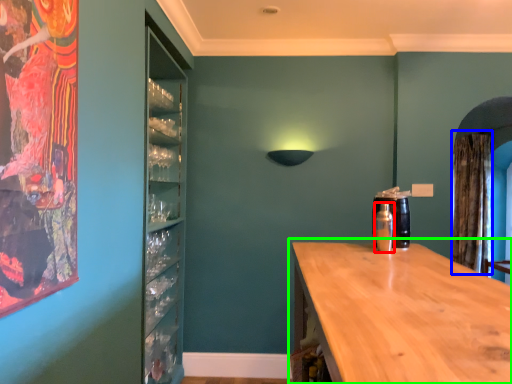
Question: Estimate the real-world distances between objects in this image. Which object is farther from bottle (highlighted by a red box), curtain (highlighted by a blue box) or countertop (highlighted by a green box)?

Choices:
 (A) curtain
 (B) countertop

Answer: (A)